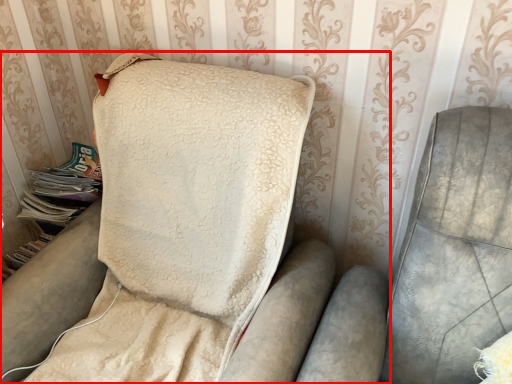
Question: From the image's perspective, what is the correct spatial positioning of furniture (annotated by the red box) in reference to magazine?

Choices:
 (A) below
 (B) above

Answer: (A)